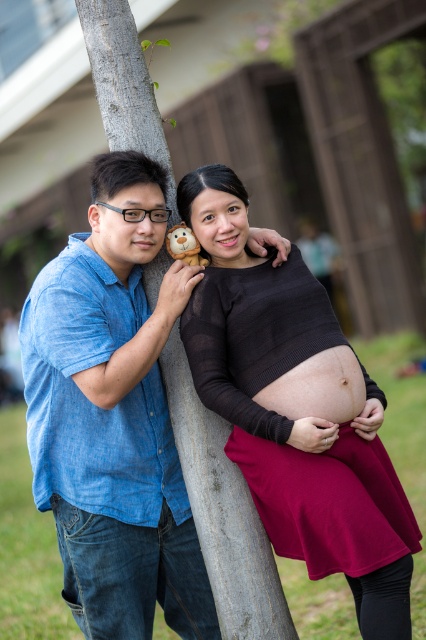
Question: Does matte black sweater at center have a larger size compared to smooth skin belly at center?

Choices:
 (A) yes
 (B) no

Answer: (A)

Question: Which object is closer to the camera taking this photo?

Choices:
 (A) matte black sweater at center
 (B) blue denim shirt at left
 (C) smooth skin belly at center
 (D) gray rough tree trunk at center

Answer: (A)

Question: Does blue denim shirt at left have a smaller size compared to smooth skin belly at center?

Choices:
 (A) yes
 (B) no

Answer: (B)

Question: Does matte black sweater at center appear on the right side of smooth skin belly at center?

Choices:
 (A) yes
 (B) no

Answer: (B)

Question: Which object appears farthest from the camera in this image?

Choices:
 (A) matte black sweater at center
 (B) blue denim shirt at left
 (C) smooth skin belly at center

Answer: (B)

Question: Which object is the closest to the matte black sweater at center?

Choices:
 (A) gray rough tree trunk at center
 (B) smooth skin belly at center

Answer: (B)